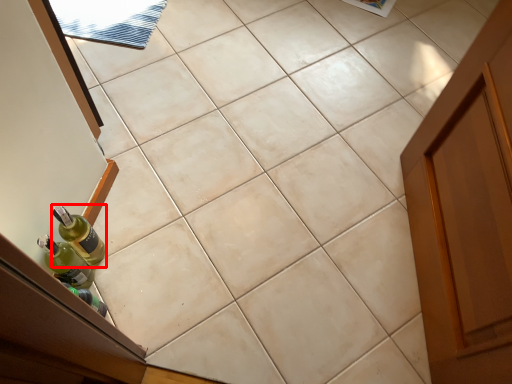
Question: From the image's perspective, what is the correct spatial positioning of bottle (annotated by the red box) in reference to bottle?

Choices:
 (A) below
 (B) above

Answer: (B)